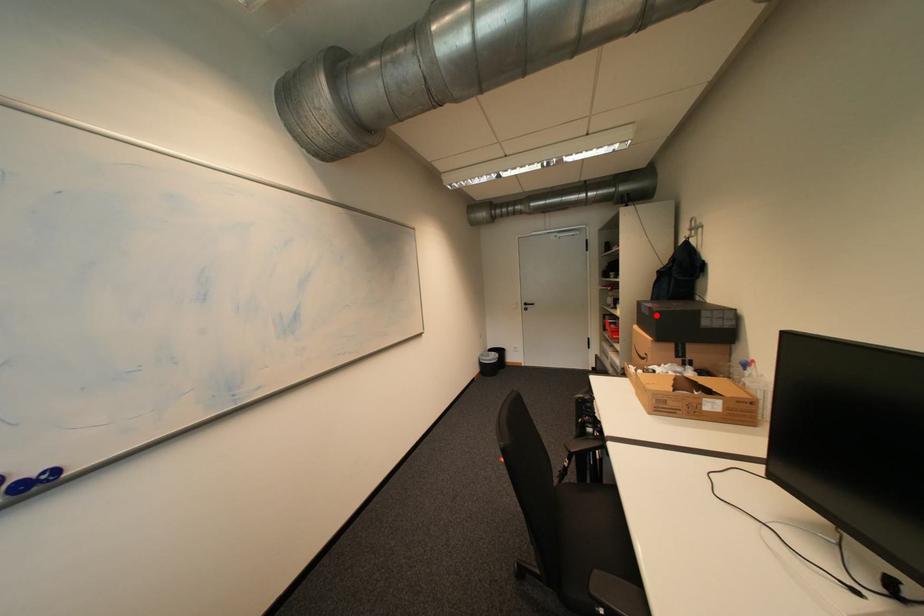
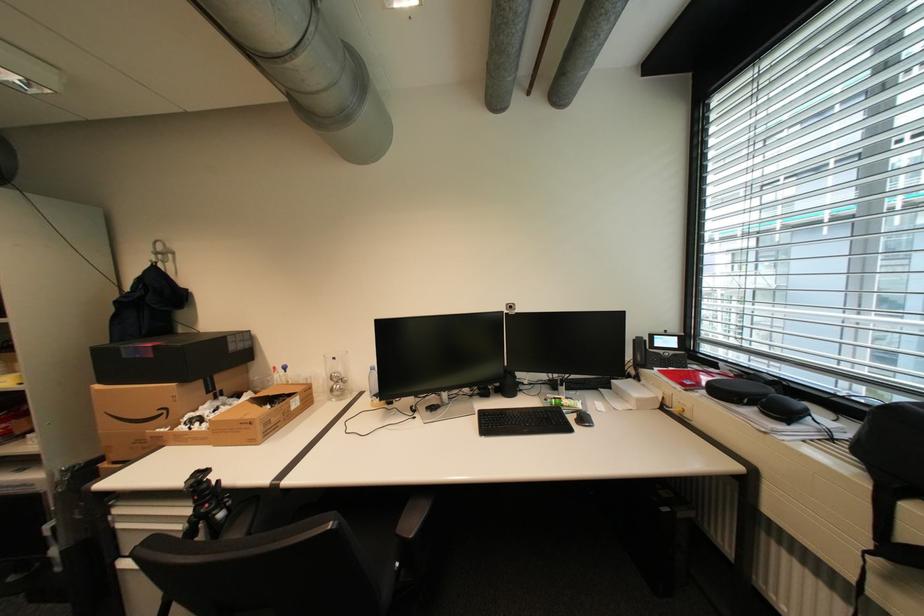
Where in the second image is the point corresponding to the highlighted location from the first image?

(161, 357)